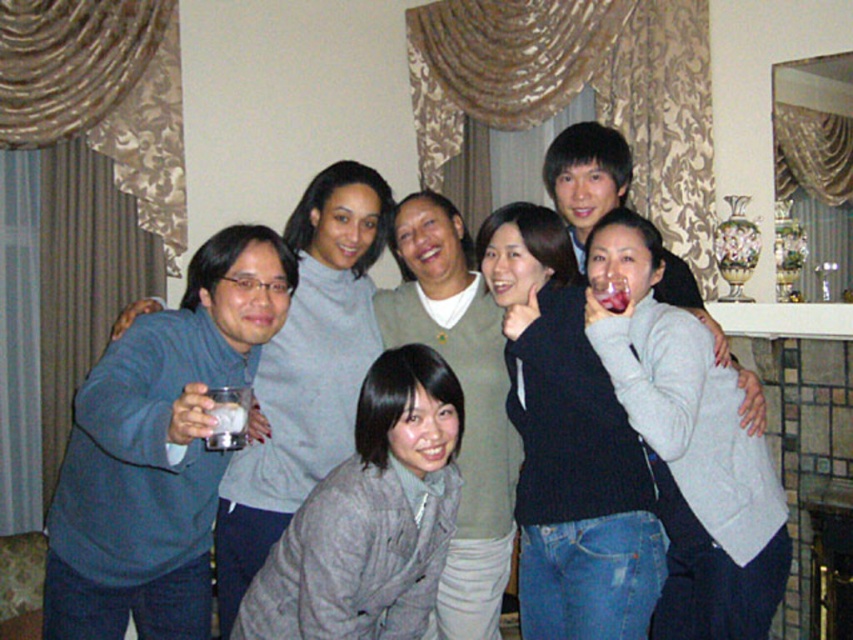
From the picture: In the scene described, there are two sweaters at the center of the image. The dark blue sweater at center and the matte gray sweater at center. From the perspective of someone facing the image, which sweater is positioned to the right?

The dark blue sweater at center is to the right of the matte gray sweater at center.

Based on the scene description, if you were to draw a dot on the image where the dark blue sweater at center is located, what would be the coordinates of that dot?

The coordinates of the dark blue sweater at center are at point [567,445].